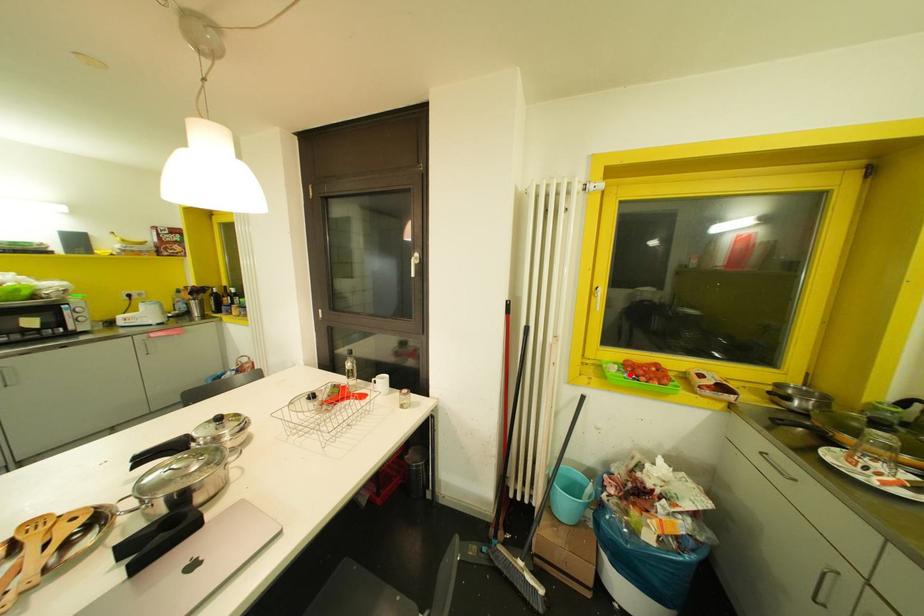
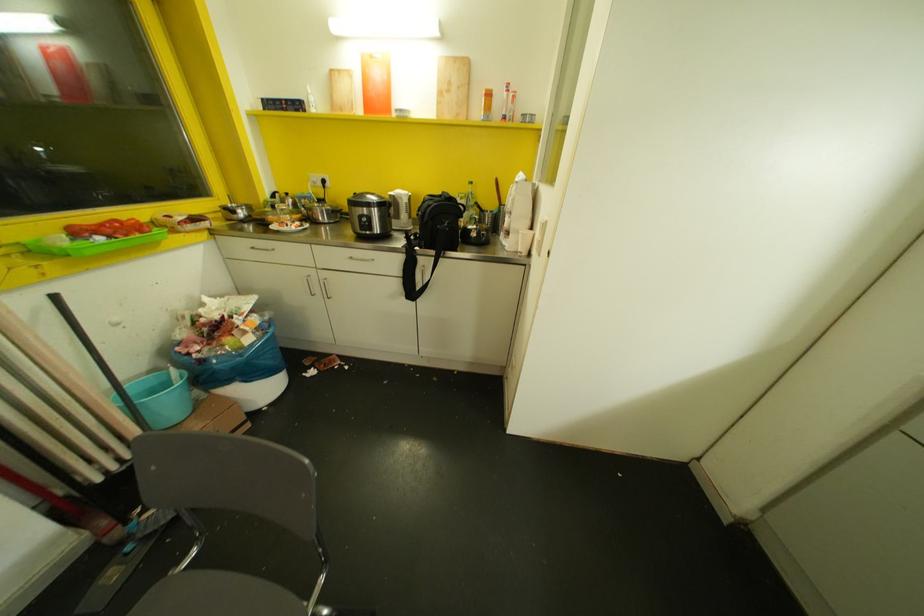
Locate, in the second image, the point that corresponds to the highlighted location in the first image.

(99, 237)